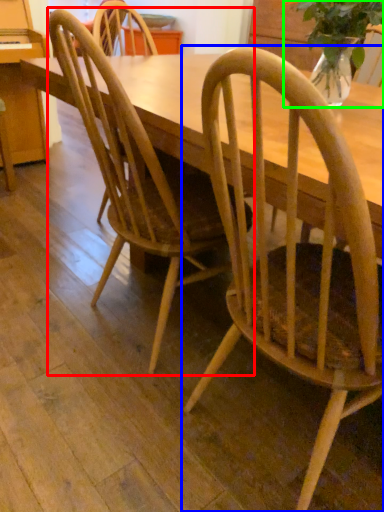
Question: Which is nearer to the chair (highlighted by a red box)? chair (highlighted by a blue box) or houseplant (highlighted by a green box).

Choices:
 (A) chair
 (B) houseplant

Answer: (A)